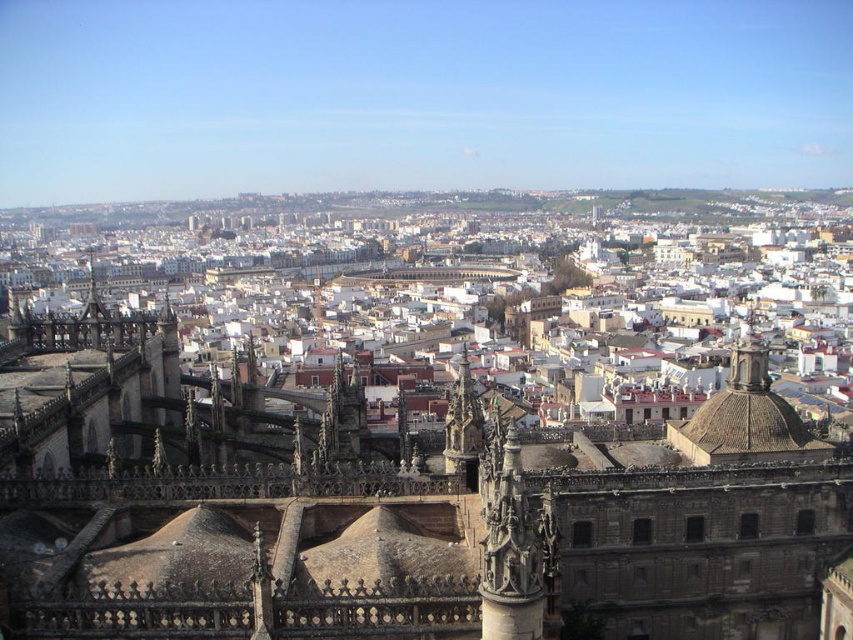
Question: Can you confirm if carved stone spire at center is positioned to the right of dark brown stone tower at center?

Choices:
 (A) yes
 (B) no

Answer: (A)

Question: Which point is closer to the camera?

Choices:
 (A) carved stone spire at center
 (B) dark brown stone tower at center

Answer: (A)

Question: Observing the image, what is the correct spatial positioning of carved stone spire at center in reference to dark brown stone tower at center?

Choices:
 (A) right
 (B) left

Answer: (A)

Question: Does carved stone spire at center have a larger size compared to dark brown stone tower at center?

Choices:
 (A) no
 (B) yes

Answer: (A)